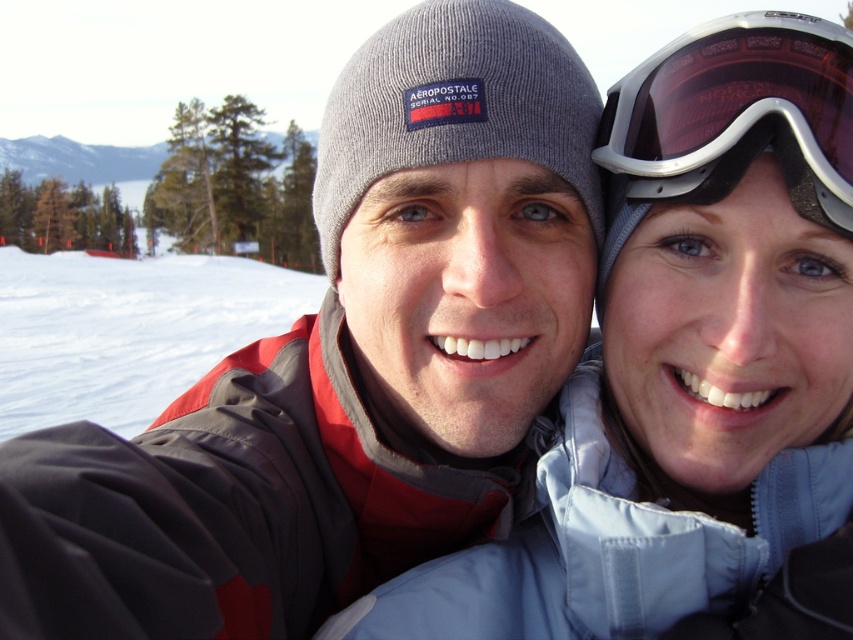
What do you see at coordinates (128, 330) in the screenshot? The height and width of the screenshot is (640, 853). I see `white powder snow at lower left` at bounding box center [128, 330].

Is white powder snow at lower left shorter than matte black goggles at upper right?

Incorrect, white powder snow at lower left's height does not fall short of matte black goggles at upper right's.

Is point (24, 317) farther from camera compared to point (840, 177)?

That is True.

Where is `white powder snow at lower left`? Image resolution: width=853 pixels, height=640 pixels. white powder snow at lower left is located at coordinates (128, 330).